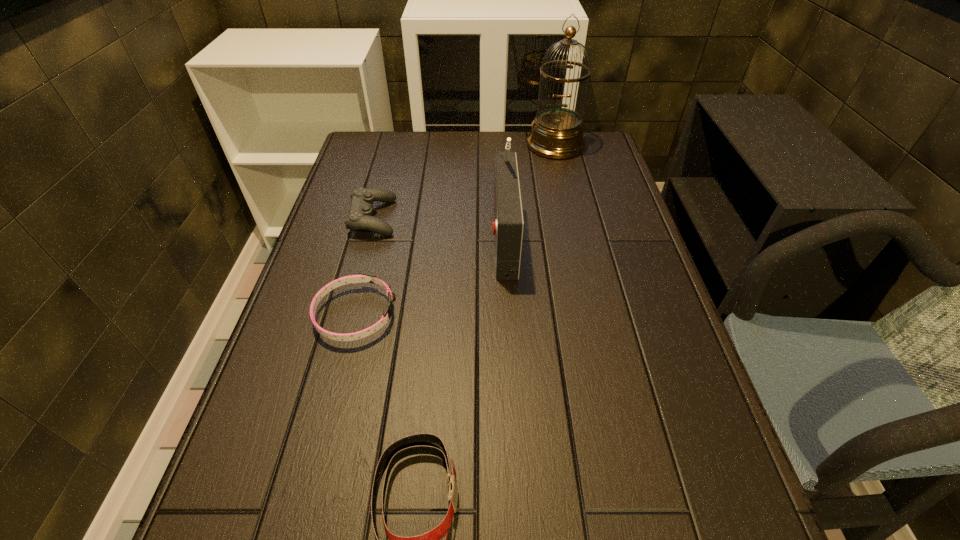
Identify the location of free space at the right edge. The width and height of the screenshot is (960, 540). (616, 207).

Where is `free space between the left dog collar and the control`? The height and width of the screenshot is (540, 960). free space between the left dog collar and the control is located at coordinates (364, 266).

I want to click on vacant space that is in between the farther dog collar and the birdcage, so click(455, 230).

Where is `empty space that is in between the second object from right to left and the control`? The image size is (960, 540). empty space that is in between the second object from right to left and the control is located at coordinates (438, 227).

The height and width of the screenshot is (540, 960). Identify the location of empty location between the control and the rightmost object. (465, 181).

This screenshot has height=540, width=960. I want to click on free area in between the rightmost object and the fourth shortest object, so click(529, 191).

Identify which object is located as the nearest to the shorter dog collar. Please provide its 2D coordinates. Your answer should be formatted as a tuple, i.e. [(x, y)], where the tuple contains the x and y coordinates of a point satisfying the conditions above.

[(360, 217)]

Image resolution: width=960 pixels, height=540 pixels. I want to click on object that is the fourth closest to the left dog collar, so click(557, 133).